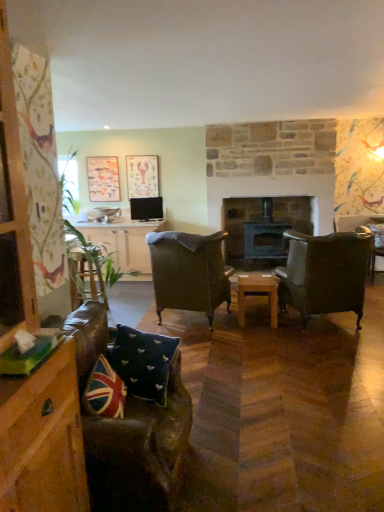
Question: In terms of size, does velvet green armchair at right, the 1th chair when ordered from right to left, appear bigger or smaller than union jack fabric pillow at lower left, acting as the second pillow starting from the back?

Choices:
 (A) big
 (B) small

Answer: (A)

Question: Visually, is velvet green armchair at right, positioned as the third chair in front-to-back order, positioned to the left or to the right of union jack fabric pillow at lower left, which appears as the first pillow when viewed from the front?

Choices:
 (A) left
 (B) right

Answer: (B)

Question: Considering the real-world distances, which object is farthest from the dark brown wood fireplace at center?

Choices:
 (A) union jack fabric pillow at lower left, acting as the second pillow starting from the back
 (B) matte wooden picture frame at upper left, arranged as the 2th picture frame when viewed from the right
 (C) dark brown leather chair at center, the 3th chair from the right
 (D) wooden table at center
 (E) leather armchair at right, the 2th chair in the right-to-left sequence

Answer: (A)

Question: Which object is positioned farthest from the union jack fabric pillow at lower left, acting as the second pillow starting from the back?

Choices:
 (A) leather armchair at right, the 1th chair when ordered from front to back
 (B) dark brown leather chair at center, acting as the second chair starting from the back
 (C) wooden table at center
 (D) matte pink paper at upper center, the second picture frame viewed from the left
 (E) matte wooden picture frame at upper left, the first picture frame positioned from the left

Answer: (E)